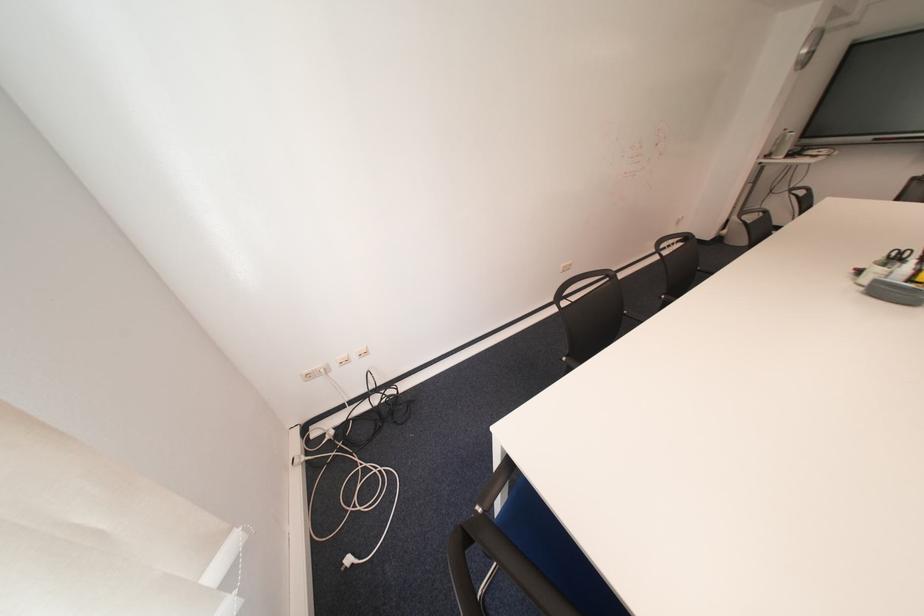
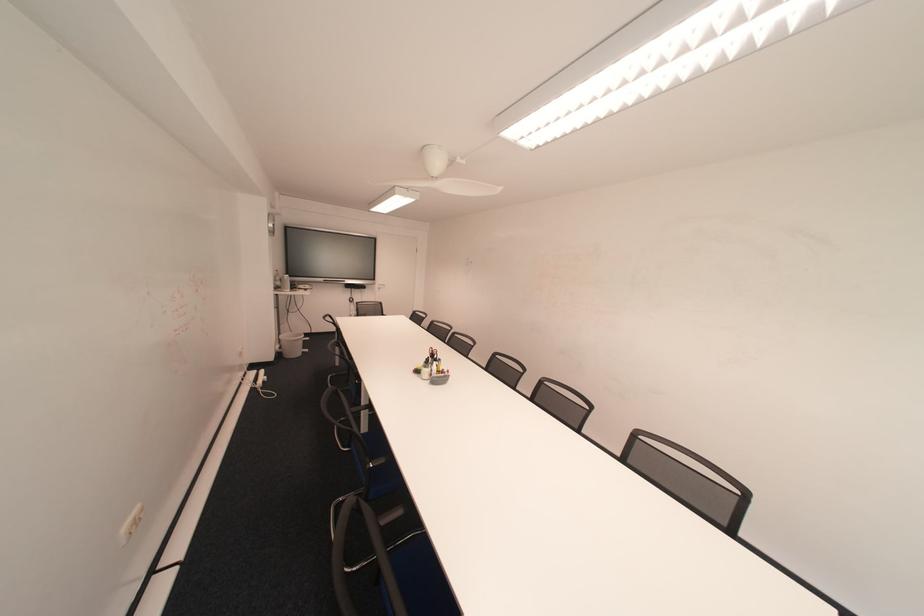
Where in the second image is the point corresponding to point (732, 240) from the first image?

(290, 355)